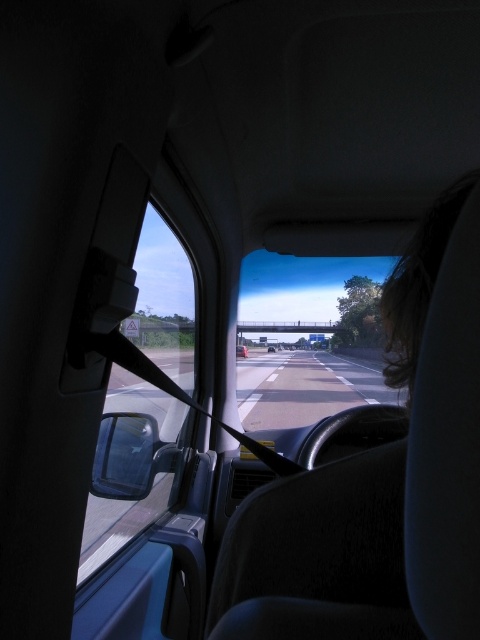
You are a passenger in the car and want to check the road ahead. Which object, the transparent glass windshield at center or the transparent plastic side mirror at lower left, would allow you to see the distant bridge more clearly?

The transparent glass windshield at center has a greater height compared to the transparent plastic side mirror at lower left, so the windshield provides a better view of the distant bridge.

You are sitting in the passenger seat of a car and notice a transparent plastic side mirror at lower left and a metallic silver car at center ahead on the highway. Which object is positioned higher from your viewpoint?

The transparent plastic side mirror at lower left is located above the metallic silver car at center, so it is positioned higher from your viewpoint.